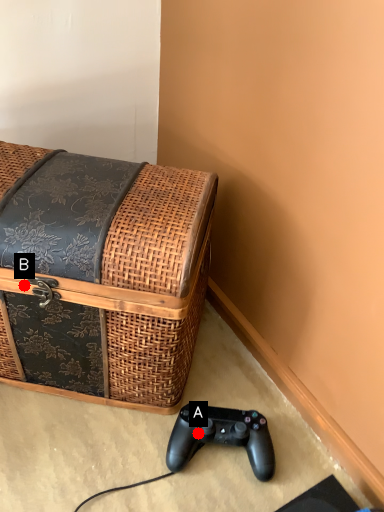
Question: Two points are circled on the image, labeled by A and B beside each circle. Which point is farther from the camera taking this photo?

Choices:
 (A) A is further
 (B) B is further

Answer: (A)